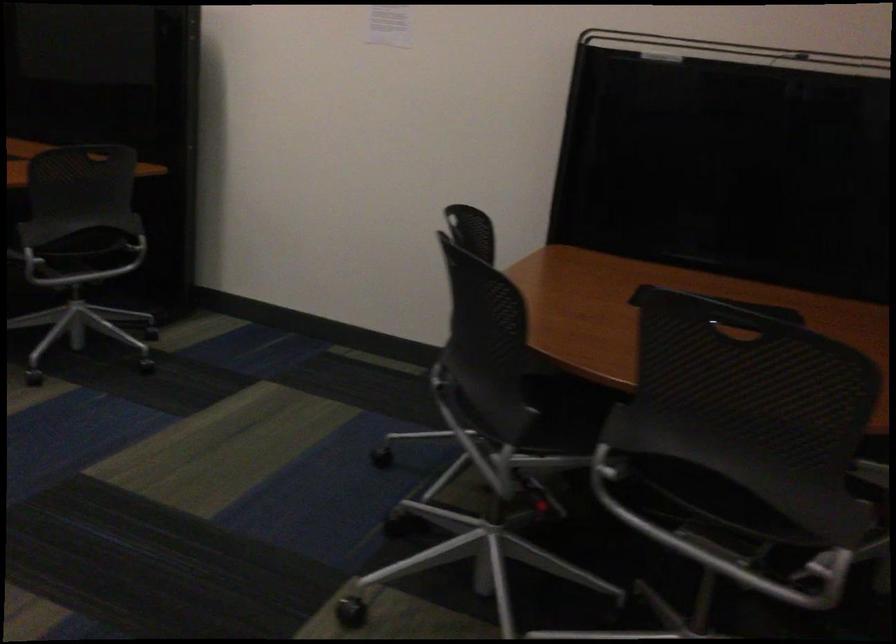
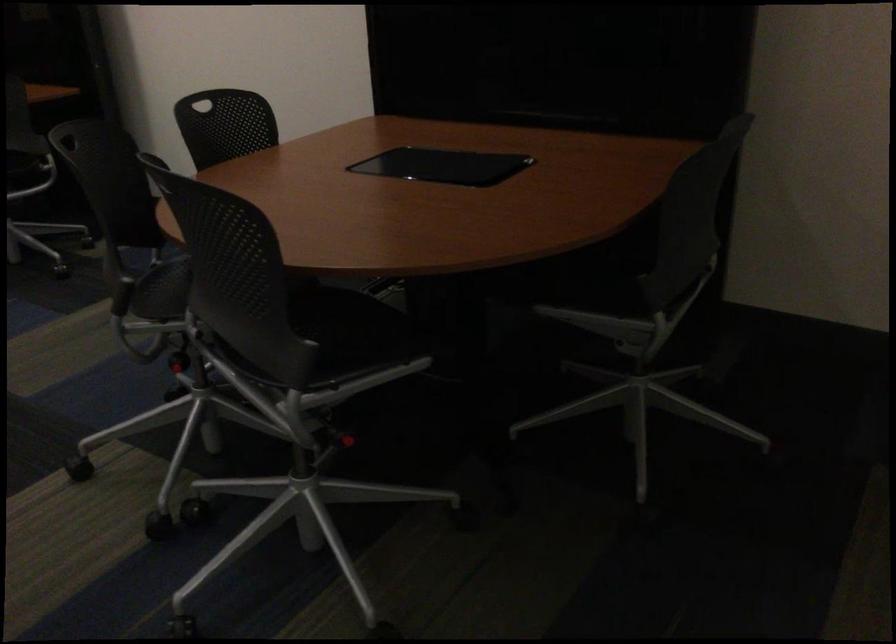
The point at [527,413] is marked in the first image. Where is the corresponding point in the second image?

(126, 287)